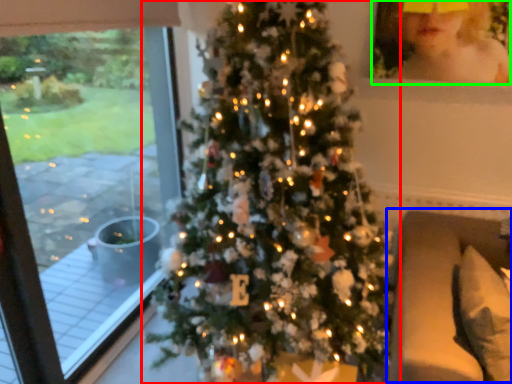
Question: Estimate the real-world distances between objects in this image. Which object is farther from christmas tree (highlighted by a red box), couch (highlighted by a blue box) or toddler (highlighted by a green box)?

Choices:
 (A) couch
 (B) toddler

Answer: (B)